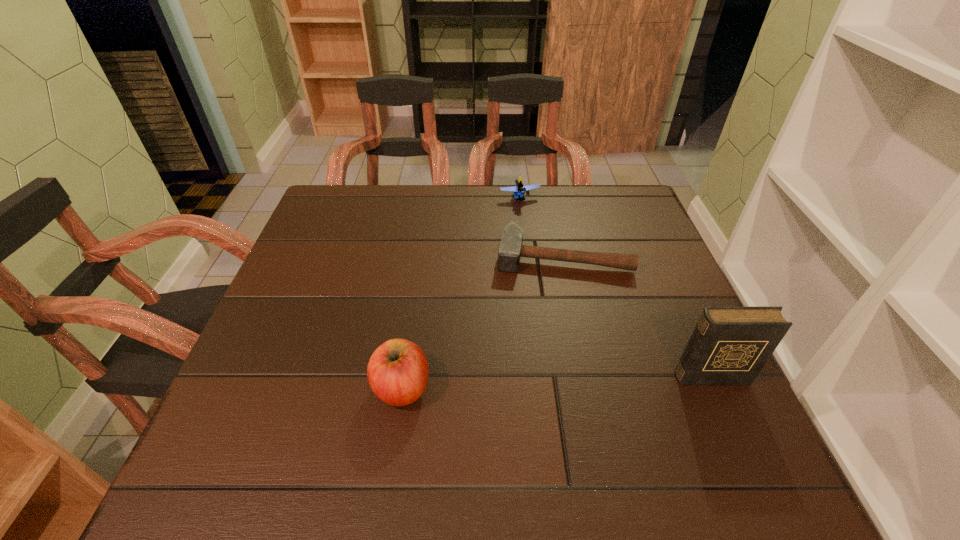
The height and width of the screenshot is (540, 960). I want to click on free location at the far edge, so (x=456, y=194).

At what (x,y) coordinates should I click in order to perform the action: click on free space at the near edge of the desktop. Please return your answer as a coordinate pair (x, y). The width and height of the screenshot is (960, 540). Looking at the image, I should click on (543, 400).

Identify the location of free space at the left edge of the desktop. Image resolution: width=960 pixels, height=540 pixels. (312, 346).

The width and height of the screenshot is (960, 540). In the image, there is a desktop. In order to click on vacant region at the right edge in this screenshot , I will do `click(637, 362)`.

Identify the location of vacant region at the far left corner of the desktop. (365, 196).

Identify the location of free point at the far right corner. The width and height of the screenshot is (960, 540). (612, 186).

In order to click on free space between the third tallest object and the hammer in this screenshot , I will do `click(541, 227)`.

What are the coordinates of `vacant space in between the rightmost object and the second shortest object` in the screenshot? It's located at (615, 287).

Identify the location of vacant region between the leftmost object and the second farthest object. (483, 322).

The height and width of the screenshot is (540, 960). I want to click on vacant area that lies between the third nearest object and the second shortest object, so click(541, 227).